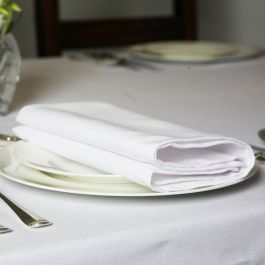
Locate an element on the screen. The image size is (265, 265). silver metallic utensils is located at coordinates click(104, 59), click(109, 54), click(24, 214), click(3, 229), click(260, 157), click(263, 134), click(5, 139).